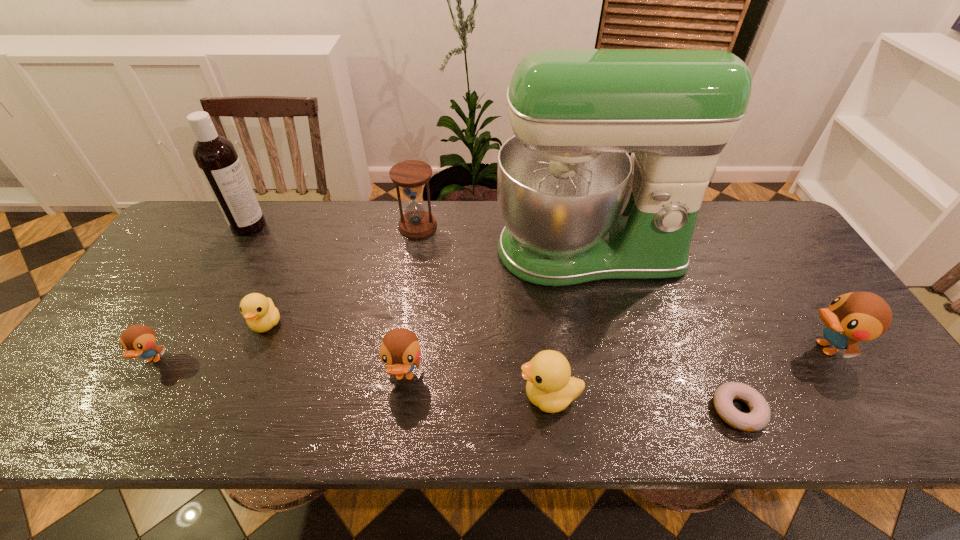
Find the location of a particular element. This screenshot has height=540, width=960. hourglass present at the far edge is located at coordinates (410, 175).

Where is `doughnut located at the near edge`? doughnut located at the near edge is located at coordinates (759, 416).

Where is `dishwasher detergent that is at the left edge`? Image resolution: width=960 pixels, height=540 pixels. dishwasher detergent that is at the left edge is located at coordinates (216, 157).

You are a GUI agent. You are given a task and a screenshot of the screen. Output one action in this format:
    pyautogui.click(x=<x>, y=<y>)
    Task: Click on the duck situated at the left edge
    This screenshot has width=960, height=540.
    Given the screenshot: What is the action you would take?
    pyautogui.click(x=137, y=340)

I want to click on object located at the right edge, so click(857, 316).

At what (x,y) coordinates should I click in order to perform the action: click on object present at the far left corner. Please return your answer as a coordinate pair (x, y). This screenshot has width=960, height=540. Looking at the image, I should click on (216, 157).

Locate an element on the screen. free space at the far edge of the desktop is located at coordinates point(291,243).

Where is `free region at the near edge of the desktop`? This screenshot has height=540, width=960. free region at the near edge of the desktop is located at coordinates (403, 403).

Find the location of a particular element. This screenshot has width=960, height=540. vacant space at the far left corner of the desktop is located at coordinates (210, 210).

Identify the location of free point at the near left corner. The height and width of the screenshot is (540, 960). point(61,413).